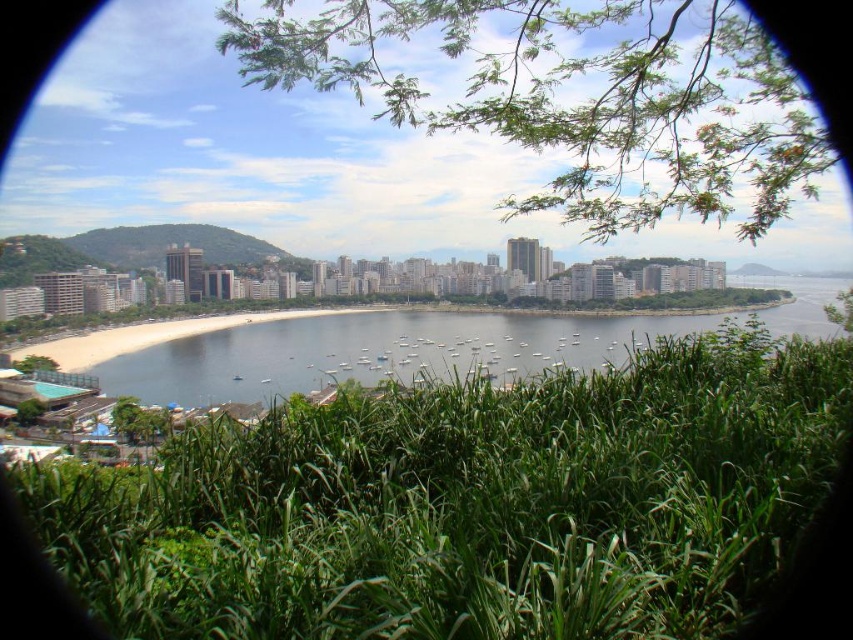
You are standing at the viewpoint overlooking the coastal cityscape and want to determine which of the two points, point (305, 612) or point (334, 324), is closer to you. Based on the scene, which point is nearer?

Point (305, 612) is closer to the viewer than point (334, 324).

You are standing on the beach and see the green leafy grass at lower center and the clear blue water at center. Which object is closer to your feet?

The green leafy grass at lower center is closer to your feet since it is located below the clear blue water at center.

You are a photographer standing at the edge of the beach, aiming to capture the green leafy grass at lower center and the clear blue water at center in your shot. Which object will appear closer to the bottom of the photo?

The green leafy grass at lower center will appear closer to the bottom of the photo because it is positioned lower in the scene than the clear blue water at center.